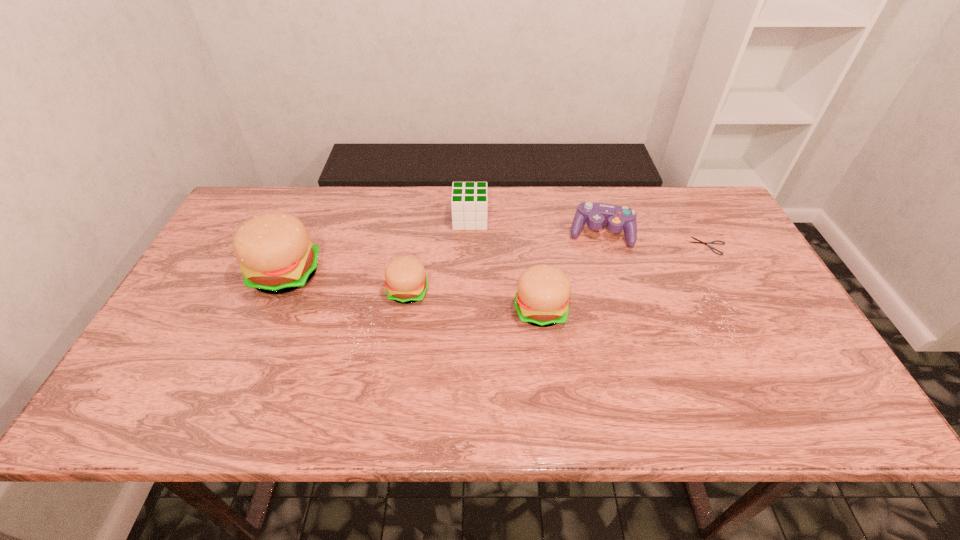
In the current image, all hamburgers are evenly spaced. To maintain this equal spacing, where should an additional hamburger be placed on the right? Please point out a free spot. Please provide its 2D coordinates. Your answer should be formatted as a tuple, i.e. [(x, y)], where the tuple contains the x and y coordinates of a point satisfying the conditions above.

[(684, 330)]